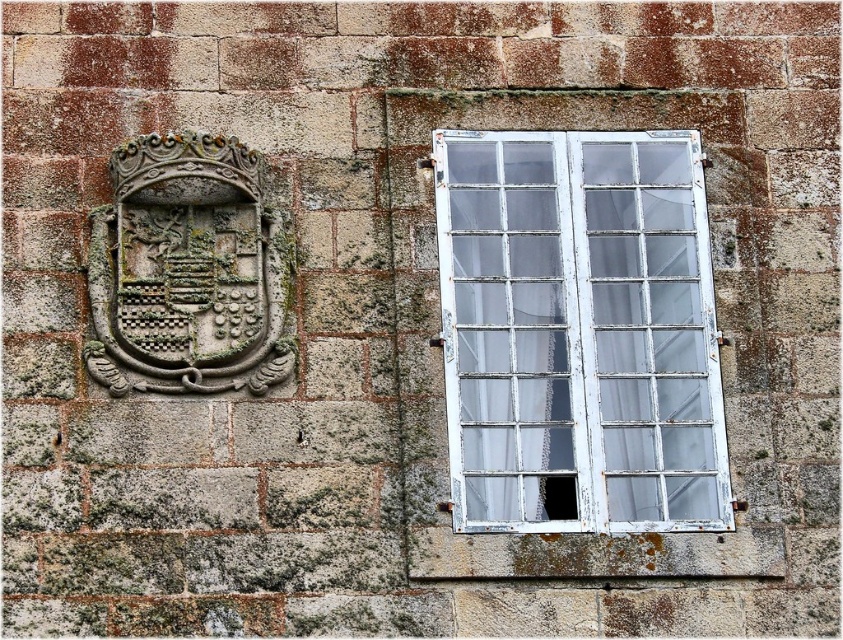
Is white painted wood window at right further to camera compared to carved stone coat of arms at upper left?

No, it is in front of carved stone coat of arms at upper left.

Can you confirm if white painted wood window at right is shorter than carved stone coat of arms at upper left?

No, white painted wood window at right is not shorter than carved stone coat of arms at upper left.

Is point (616, 208) farther from camera compared to point (197, 337)?

Yes, point (616, 208) is behind point (197, 337).

The image size is (843, 640). Identify the location of white painted wood window at right. (578, 330).